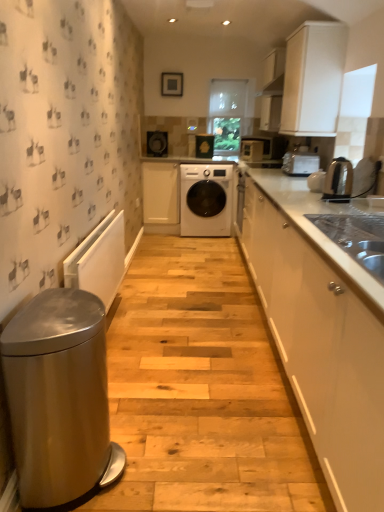
The image size is (384, 512). What do you see at coordinates (206, 199) in the screenshot?
I see `white matte washing machine at center` at bounding box center [206, 199].

Measure the distance between point (205, 152) and camera.

Point (205, 152) and camera are 4.93 meters apart.

The height and width of the screenshot is (512, 384). Identify the location of matte black speaker at upper center, the third appliance from the bottom. (157, 143).

Where is `white matte cabinet at upper right, arranged as the 2th cabinetry when viewed from the back`? The height and width of the screenshot is (512, 384). white matte cabinet at upper right, arranged as the 2th cabinetry when viewed from the back is located at coordinates (313, 78).

What is the approximate height of white matte cabinet at upper right, marked as the 3th cabinetry in a left-to-right arrangement?

It is 31.15 inches.

The width and height of the screenshot is (384, 512). I want to click on white glossy cabinet at right, which appears as the 2th cabinetry when viewed from the right, so click(x=321, y=331).

Find the location of a particular element. The width and height of the screenshot is (384, 512). white matte washing machine at center is located at coordinates (206, 199).

Is white glossy microwave at upper center, the 3th appliance when ordered from back to front, facing away from metallic silver kettle at right, which appears as the 1th home appliance when ordered from the bottom?

That's not correct — white glossy microwave at upper center, the 3th appliance when ordered from back to front, is not looking away from metallic silver kettle at right, which appears as the 1th home appliance when ordered from the bottom.

From the picture: Is white glossy microwave at upper center, which appears as the second appliance when viewed from the front, with metallic silver kettle at right, which appears as the 1th home appliance when ordered from the bottom?

No, white glossy microwave at upper center, which appears as the second appliance when viewed from the front, is not in contact with metallic silver kettle at right, which appears as the 1th home appliance when ordered from the bottom.

Is white glossy microwave at upper center, the 2th appliance positioned from the right, bigger than metallic silver kettle at right, positioned as the 1th home appliance in front-to-back order?

Correct, white glossy microwave at upper center, the 2th appliance positioned from the right, is larger in size than metallic silver kettle at right, positioned as the 1th home appliance in front-to-back order.

Is white matte cabinet at upper right, marked as the 3th cabinetry in a left-to-right arrangement, at the right side of white glossy cabinet at right, which is the 3th cabinetry in back-to-front order?

Indeed, white matte cabinet at upper right, marked as the 3th cabinetry in a left-to-right arrangement, is positioned on the right side of white glossy cabinet at right, which is the 3th cabinetry in back-to-front order.

Is white matte cabinet at upper right, the first cabinetry positioned from the right, not inside white glossy cabinet at right, which appears as the 2th cabinetry when viewed from the right?

Absolutely, white matte cabinet at upper right, the first cabinetry positioned from the right, is external to white glossy cabinet at right, which appears as the 2th cabinetry when viewed from the right.

Would you consider white matte cabinet at upper right, the first cabinetry positioned from the right, to be distant from white glossy cabinet at right, which appears as the 2th cabinetry when viewed from the right?

white matte cabinet at upper right, the first cabinetry positioned from the right, is positioned a significant distance from white glossy cabinet at right, which appears as the 2th cabinetry when viewed from the right.

Is matte black washing machine at center, arranged as the first appliance when viewed from the back, turned away from satin silver toaster at upper right, placed as the first home appliance when sorted from top to bottom?

No.

From the picture: Considering the sizes of objects matte black washing machine at center, arranged as the first appliance when viewed from the back, and satin silver toaster at upper right, the second home appliance positioned from the front, in the image provided, who is shorter, matte black washing machine at center, arranged as the first appliance when viewed from the back, or satin silver toaster at upper right, the second home appliance positioned from the front,?

satin silver toaster at upper right, the second home appliance positioned from the front, is shorter.

From the image's perspective, relative to satin silver toaster at upper right, which is the 2th home appliance in bottom-to-top order, is matte black washing machine at center, positioned as the 1th appliance in top-to-bottom order, above or below?

Clearly, from the image's perspective, matte black washing machine at center, positioned as the 1th appliance in top-to-bottom order, is above satin silver toaster at upper right, which is the 2th home appliance in bottom-to-top order.

Based on the photo, how many degrees apart are the facing directions of matte black washing machine at center, which is the 2th appliance in left-to-right order, and satin silver toaster at upper right, placed as the first home appliance when sorted from top to bottom?

87.8 degrees separate the facing orientations of matte black washing machine at center, which is the 2th appliance in left-to-right order, and satin silver toaster at upper right, placed as the first home appliance when sorted from top to bottom.

Is stainless steel sink at right positioned in front of white glossy microwave at upper center, marked as the third appliance in a top-to-bottom arrangement?

Yes, stainless steel sink at right is closer to the camera.

Considering the sizes of stainless steel sink at right and white glossy microwave at upper center, marked as the third appliance in a top-to-bottom arrangement, in the image, is stainless steel sink at right bigger or smaller than white glossy microwave at upper center, marked as the third appliance in a top-to-bottom arrangement,?

Considering their sizes, stainless steel sink at right takes up more space than white glossy microwave at upper center, marked as the third appliance in a top-to-bottom arrangement.

Considering the relative positions of stainless steel sink at right and white glossy microwave at upper center, the 3th appliance when ordered from back to front, in the image provided, is stainless steel sink at right to the right of white glossy microwave at upper center, the 3th appliance when ordered from back to front, from the viewer's perspective?

Correct, you'll find stainless steel sink at right to the right of white glossy microwave at upper center, the 3th appliance when ordered from back to front.

From a real-world perspective, who is located higher, white glossy kettle at upper right, which is the first appliance in bottom-to-top order, or white glossy cabinet at right, which is the 3th cabinetry in back-to-front order?

white glossy kettle at upper right, which is the first appliance in bottom-to-top order.

Can you confirm if white glossy kettle at upper right, positioned as the 1th appliance in right-to-left order, is wider than white glossy cabinet at right, acting as the second cabinetry starting from the left?

No, white glossy kettle at upper right, positioned as the 1th appliance in right-to-left order, is not wider than white glossy cabinet at right, acting as the second cabinetry starting from the left.

Considering the sizes of objects white glossy kettle at upper right, positioned as the 1th appliance in right-to-left order, and white glossy cabinet at right, which appears as the 2th cabinetry when viewed from the right, in the image provided, who is shorter, white glossy kettle at upper right, positioned as the 1th appliance in right-to-left order, or white glossy cabinet at right, which appears as the 2th cabinetry when viewed from the right,?

white glossy kettle at upper right, positioned as the 1th appliance in right-to-left order.

Between white glossy kettle at upper right, positioned as the 1th appliance in right-to-left order, and white glossy cabinet at right, positioned as the first cabinetry in front-to-back order, which one appears on the left side from the viewer's perspective?

white glossy cabinet at right, positioned as the first cabinetry in front-to-back order, is more to the left.

Who is more distant, white matte cabinet at center, arranged as the first cabinetry when viewed from the left, or satin silver toaster at upper right, the 1th home appliance from the back?

white matte cabinet at center, arranged as the first cabinetry when viewed from the left.

From the image's perspective, which one is positioned higher, white matte cabinet at center, the 1th cabinetry viewed from the back, or satin silver toaster at upper right, placed as the first home appliance when sorted from top to bottom?

white matte cabinet at center, the 1th cabinetry viewed from the back, from the image's perspective.

Is satin silver toaster at upper right, placed as the first home appliance when sorted from top to bottom, at the back of white matte cabinet at center, which ranks as the third cabinetry in front-to-back order?

white matte cabinet at center, which ranks as the third cabinetry in front-to-back order, does not have its back to satin silver toaster at upper right, placed as the first home appliance when sorted from top to bottom.

Between white matte cabinet at center, arranged as the first cabinetry when viewed from the left, and satin silver toaster at upper right, the second home appliance positioned from the front, which one appears on the left side from the viewer's perspective?

white matte cabinet at center, arranged as the first cabinetry when viewed from the left, is more to the left.

In the scene shown: Between white glossy cabinet at right, positioned as the first cabinetry in front-to-back order, and satin silver toaster at upper right, the 1th home appliance from the back, which one has more height?

white glossy cabinet at right, positioned as the first cabinetry in front-to-back order, is taller.

From a real-world perspective, who is located lower, white glossy cabinet at right, positioned as the first cabinetry in front-to-back order, or satin silver toaster at upper right, the second home appliance positioned from the front?

white glossy cabinet at right, positioned as the first cabinetry in front-to-back order, from a real-world perspective.

This screenshot has width=384, height=512. Find the location of `the 2nd home appliance above the white glossy cabinet at right, positioned as the first cabinetry in front-to-back order (from the image's perspective)`. the 2nd home appliance above the white glossy cabinet at right, positioned as the first cabinetry in front-to-back order (from the image's perspective) is located at coordinates (300, 163).

Which of these two, white glossy cabinet at right, which appears as the 2th cabinetry when viewed from the right, or satin silver toaster at upper right, which is the 2th home appliance in bottom-to-top order, is bigger?

Bigger between the two is white glossy cabinet at right, which appears as the 2th cabinetry when viewed from the right.

I want to click on the 1st appliance to the left when counting from the metallic silver kettle at right, the second home appliance positioned from the top, so (x=252, y=150).

I want to click on cabinetry above the white glossy cabinet at right, positioned as the first cabinetry in front-to-back order (from a real-world perspective), so tap(313, 78).

In the scene shown: Estimate the real-world distances between objects in this image. Which object is further from metallic silver kettle at right, positioned as the 1th home appliance in front-to-back order, polished stainless steel trash can at left or matte black speaker at upper center, positioned as the second appliance in top-to-bottom order?

Among the two, matte black speaker at upper center, positioned as the second appliance in top-to-bottom order, is located further to metallic silver kettle at right, positioned as the 1th home appliance in front-to-back order.

When comparing their distances from polished stainless steel trash can at left, does white glossy microwave at upper center, which ranks as the third appliance in left-to-right order, or metallic silver kettle at right, the second home appliance positioned from the back, seem further?

The object further to polished stainless steel trash can at left is white glossy microwave at upper center, which ranks as the third appliance in left-to-right order.

Considering their positions, is white matte washing machine at center positioned closer to white glossy cabinet at right, which appears as the 2th cabinetry when viewed from the right, than matte black speaker at upper center, the 2th appliance in the back-to-front sequence?

white matte washing machine at center.

When comparing their distances from white matte washing machine at center, does matte black speaker at upper center, positioned as the second appliance in top-to-bottom order, or stainless steel sink at right seem closer?

matte black speaker at upper center, positioned as the second appliance in top-to-bottom order, lies closer to white matte washing machine at center than the other object.

Based on the photo, when comparing their distances from metallic silver kettle at right, the second home appliance positioned from the top, does stainless steel sink at right or white glossy cabinet at right, which is the 3th cabinetry in back-to-front order, seem closer?

white glossy cabinet at right, which is the 3th cabinetry in back-to-front order, is positioned closer to the anchor metallic silver kettle at right, the second home appliance positioned from the top.

When comparing their distances from stainless steel sink at right, does matte black microwave at upper right or matte black washing machine at center, positioned as the 1th appliance in top-to-bottom order, seem further?

matte black washing machine at center, positioned as the 1th appliance in top-to-bottom order, lies further to stainless steel sink at right than the other object.

Which object lies nearer to the anchor point matte black speaker at upper center, positioned as the second appliance in top-to-bottom order, matte black microwave at upper right or white matte cabinet at upper right, arranged as the 2th cabinetry when viewed from the back?

matte black microwave at upper right is positioned closer to the anchor matte black speaker at upper center, positioned as the second appliance in top-to-bottom order.

Consider the image. Estimate the real-world distances between objects in this image. Which object is further from white glossy microwave at upper center, positioned as the second appliance in bottom-to-top order, white glossy cabinet at right, which appears as the 2th cabinetry when viewed from the right, or matte black speaker at upper center, the 2th appliance in the back-to-front sequence?

white glossy cabinet at right, which appears as the 2th cabinetry when viewed from the right, is further to white glossy microwave at upper center, positioned as the second appliance in bottom-to-top order.

The height and width of the screenshot is (512, 384). Identify the location of home appliance between polished stainless steel trash can at left and white glossy kettle at upper right, the 4th appliance positioned from the top, from left to right. (338, 181).

Find the location of a particular element. The image size is (384, 512). sink located between white glossy cabinet at right, which appears as the 2th cabinetry when viewed from the right, and matte black microwave at upper right in the depth direction is located at coordinates (356, 238).

Find the location of a particular element. cabinetry between white glossy kettle at upper right, which is the fourth appliance in back-to-front order, and white matte cabinet at center, arranged as the first cabinetry when viewed from the left, from front to back is located at coordinates (313, 78).

At what (x,y) coordinates should I click in order to perform the action: click on home appliance between metallic silver kettle at right, which appears as the 1th home appliance when ordered from the bottom, and matte black speaker at upper center, the third appliance when ordered from front to back, in the front-back direction. Please return your answer as a coordinate pair (x, y). Looking at the image, I should click on (300, 163).